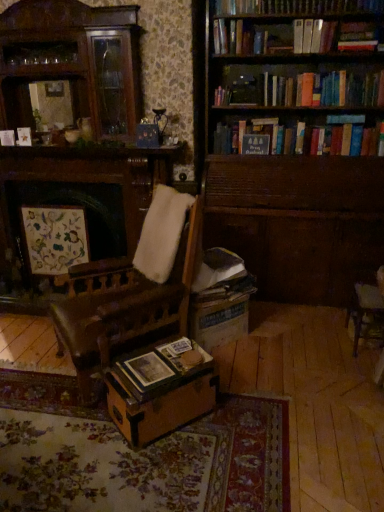
Identify the location of unoccupied region to the right of wooden trunk at center. (242, 418).